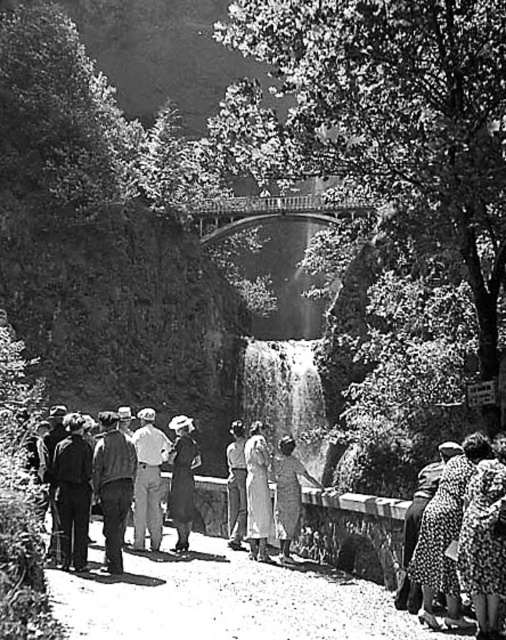
Can you confirm if smooth concrete path at center is positioned to the right of smooth stone waterfall at center?

In fact, smooth concrete path at center is to the left of smooth stone waterfall at center.

Does smooth concrete path at center have a larger size compared to smooth stone waterfall at center?

Incorrect, smooth concrete path at center is not larger than smooth stone waterfall at center.

Describe the element at coordinates (225, 600) in the screenshot. I see `smooth concrete path at center` at that location.

Identify the location of smooth concrete path at center. (225, 600).

The height and width of the screenshot is (640, 506). Identify the location of smooth stone waterfall at center. (285, 396).

How far apart are smooth stone waterfall at center and dark gray wool coat at center?

A distance of 24.08 meters exists between smooth stone waterfall at center and dark gray wool coat at center.

Is point (274, 396) positioned before point (184, 417)?

No, (274, 396) is further to viewer.

The image size is (506, 640). Find the location of `smooth stone waterfall at center`. smooth stone waterfall at center is located at coordinates (285, 396).

From the picture: Is white cotton dress at center to the right of dark fabric dress at center from the viewer's perspective?

Incorrect, white cotton dress at center is not on the right side of dark fabric dress at center.

This screenshot has width=506, height=640. What do you see at coordinates (257, 493) in the screenshot? I see `white cotton dress at center` at bounding box center [257, 493].

Is point (262, 435) positioned before point (302, 476)?

No, (262, 435) is behind (302, 476).

Locate an element on the screen. white cotton dress at center is located at coordinates tap(257, 493).